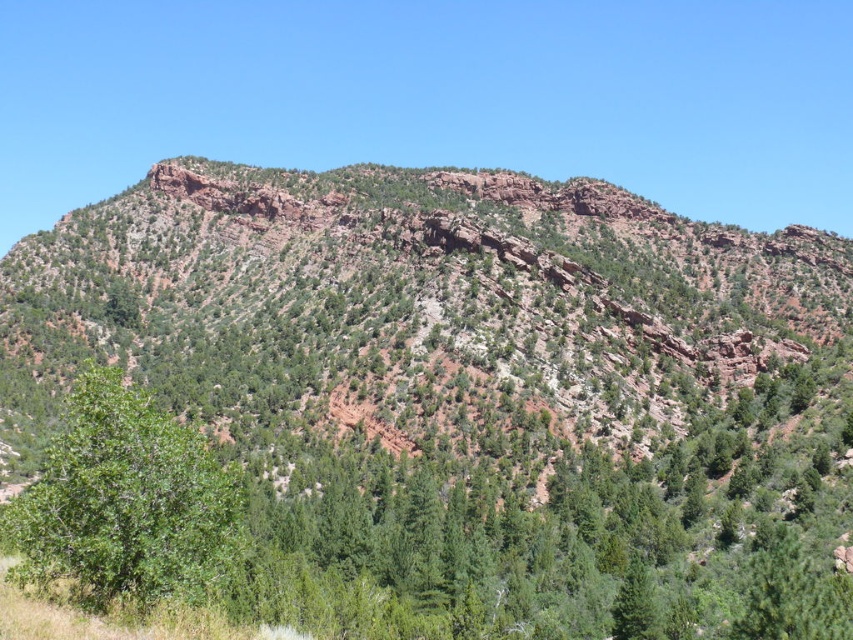
Question: Which of the following is the farthest from the observer?

Choices:
 (A) (730, 579)
 (B) (598, 225)

Answer: (B)

Question: From the image, what is the correct spatial relationship of rustic rock mountain at center in relation to green leafy tree at lower left?

Choices:
 (A) above
 (B) below

Answer: (A)

Question: Is rustic rock mountain at center below green leafy tree at lower left?

Choices:
 (A) no
 (B) yes

Answer: (A)

Question: Which object is the farthest from the green leafy tree at center?

Choices:
 (A) rustic rock mountain at center
 (B) green leafy tree at lower left

Answer: (A)

Question: Is rustic rock mountain at center to the left of green leafy tree at center from the viewer's perspective?

Choices:
 (A) yes
 (B) no

Answer: (B)

Question: Based on their relative distances, which object is nearer to the rustic rock mountain at center?

Choices:
 (A) green leafy tree at center
 (B) green leafy tree at lower left

Answer: (A)